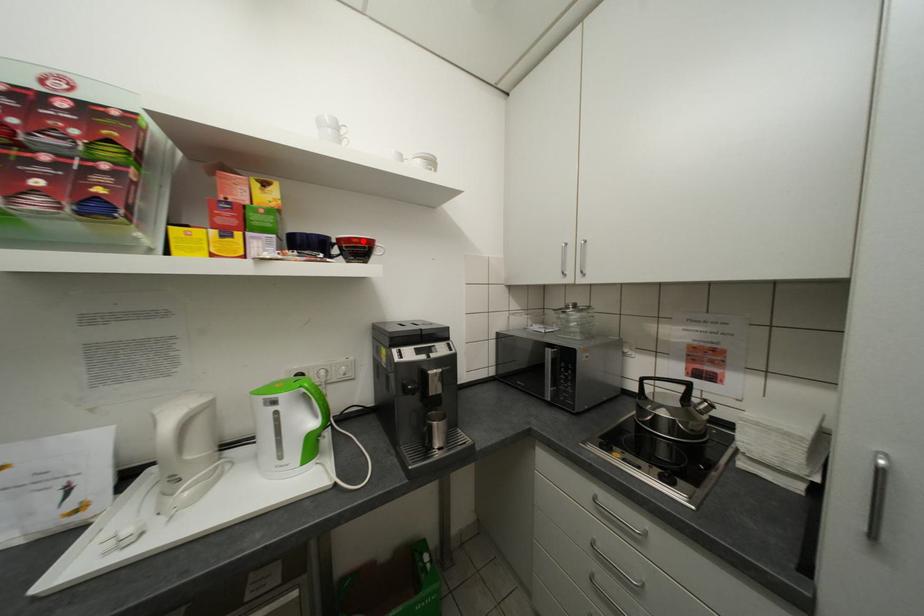
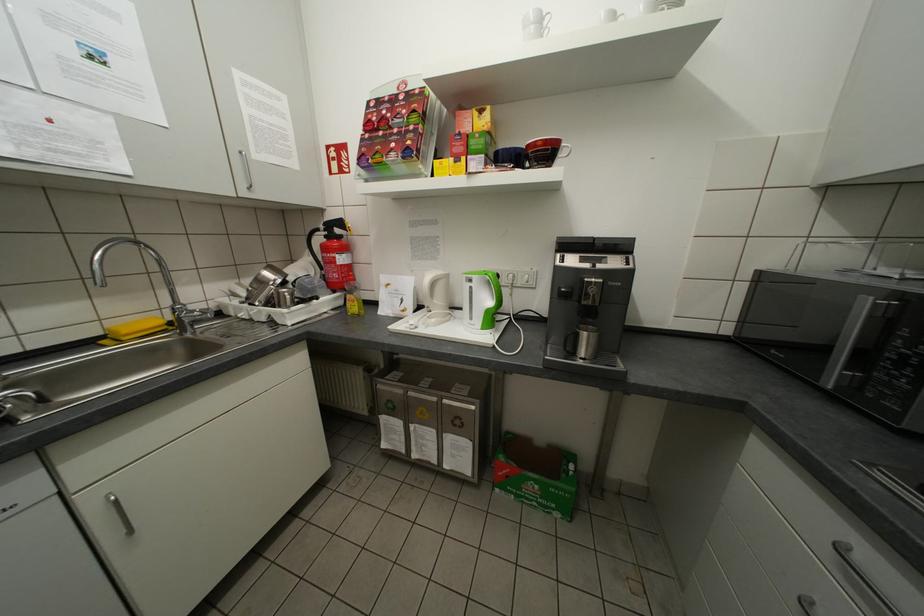
Find the pixel in the second image that matches the highlighted location in the first image.

(548, 144)